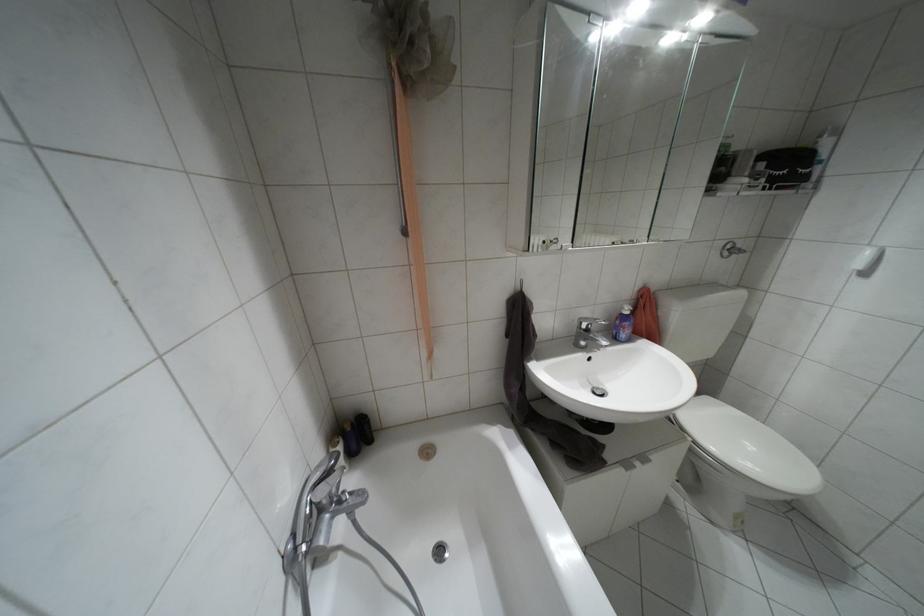
The location [349,439] corresponds to which object?

This point indicates the dark purple bottle.